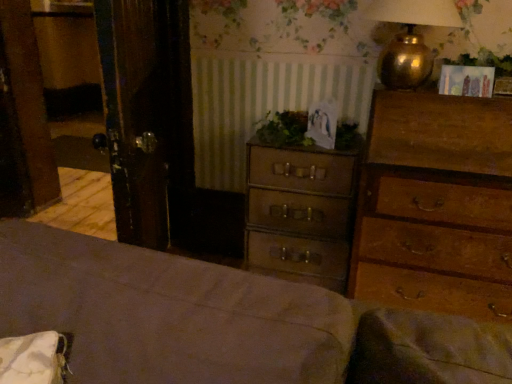
Measure the distance between wooden chest of drawers at right, which is counted as the 1th chest of drawers, starting from the right, and camera.

wooden chest of drawers at right, which is counted as the 1th chest of drawers, starting from the right, is 4.45 feet away from camera.

Where is `gold metallic lamp at upper right`? gold metallic lamp at upper right is located at coordinates (409, 39).

Where is `brown wooden bed frame at lower left`? Image resolution: width=512 pixels, height=384 pixels. brown wooden bed frame at lower left is located at coordinates (222, 321).

Find the location of a particular element. The height and width of the screenshot is (384, 512). green leafy plant at center, which is the 1th plant from left to right is located at coordinates (284, 129).

Locate an element on the screen. The width and height of the screenshot is (512, 384). brown leather suitcase at center, which ranks as the first chest of drawers in left-to-right order is located at coordinates (300, 212).

I want to click on green leafy plant at upper right, acting as the 2th plant starting from the bottom, so click(x=485, y=61).

From the image's perspective, starting from the brown leather suitcase at center, which ranks as the first chest of drawers in left-to-right order, which plant is the 2nd one above? Please provide its 2D coordinates.

[(485, 61)]

Between green leafy plant at upper right, acting as the 2th plant starting from the bottom, and brown leather suitcase at center, which ranks as the first chest of drawers in left-to-right order, which one is positioned behind?

brown leather suitcase at center, which ranks as the first chest of drawers in left-to-right order, is behind.

Is green leafy plant at upper right, the first plant from the right, taller than brown leather suitcase at center, which ranks as the first chest of drawers in left-to-right order?

In fact, green leafy plant at upper right, the first plant from the right, may be shorter than brown leather suitcase at center, which ranks as the first chest of drawers in left-to-right order.

Which of these two, brown wooden bed frame at lower left or gold metallic lamp at upper right, stands shorter?

With less height is gold metallic lamp at upper right.

Is point (176, 362) closer to viewer compared to point (424, 66)?

Yes, it is.

Is brown wooden bed frame at lower left thinner than gold metallic lamp at upper right?

No.

Measure the distance from brown wooden bed frame at lower left to wooden picture frame at upper right.

They are 4.10 feet apart.

The image size is (512, 384). What are the coordinates of `bed frame located in front of the wooden picture frame at upper right` in the screenshot? It's located at (222, 321).

Which is behind, brown wooden bed frame at lower left or wooden picture frame at upper right?

Positioned behind is wooden picture frame at upper right.

From the image's perspective, does brown wooden bed frame at lower left appear lower than wooden picture frame at upper right?

Yes, from the image's perspective, brown wooden bed frame at lower left is below wooden picture frame at upper right.

Is gold metallic lamp at upper right closer to the viewer compared to wooden picture frame at upper right?

That is True.

From the image's perspective, which object appears higher, gold metallic lamp at upper right or wooden picture frame at upper right?

gold metallic lamp at upper right.

Visually, is gold metallic lamp at upper right positioned to the left or to the right of wooden picture frame at upper right?

In the image, gold metallic lamp at upper right appears on the left side of wooden picture frame at upper right.

How many degrees apart are the facing directions of gold metallic lamp at upper right and wooden picture frame at upper right?

There is a 3.41-degree angle between the facing directions of gold metallic lamp at upper right and wooden picture frame at upper right.

Considering the relative sizes of brown wooden bed frame at lower left and wooden chest of drawers at right, which is counted as the 1th chest of drawers, starting from the right, in the image provided, is brown wooden bed frame at lower left shorter than wooden chest of drawers at right, which is counted as the 1th chest of drawers, starting from the right,?

Indeed, brown wooden bed frame at lower left has a lesser height compared to wooden chest of drawers at right, which is counted as the 1th chest of drawers, starting from the right.

Is brown wooden bed frame at lower left next to wooden chest of drawers at right, which is the 2th chest of drawers from left to right, and touching it?

brown wooden bed frame at lower left and wooden chest of drawers at right, which is the 2th chest of drawers from left to right, are not in contact.

Does point (90, 269) appear closer or farther from the camera than point (476, 227)?

Point (90, 269) is positioned closer to the camera compared to point (476, 227).

From the picture: Considering the positions of objects brown wooden bed frame at lower left and wooden chest of drawers at right, which is counted as the 1th chest of drawers, starting from the right, in the image provided, who is more to the right, brown wooden bed frame at lower left or wooden chest of drawers at right, which is counted as the 1th chest of drawers, starting from the right,?

wooden chest of drawers at right, which is counted as the 1th chest of drawers, starting from the right, is more to the right.

Identify the location of the chest of drawers that is the 2nd one below the wooden picture frame at upper right (from a real-world perspective). The height and width of the screenshot is (384, 512). (436, 206).

Relative to wooden chest of drawers at right, which is the 2th chest of drawers from left to right, is wooden picture frame at upper right in front or behind?

Clearly, wooden picture frame at upper right is behind wooden chest of drawers at right, which is the 2th chest of drawers from left to right.

Who is shorter, wooden picture frame at upper right or wooden chest of drawers at right, which is the 2th chest of drawers from left to right?

wooden picture frame at upper right is shorter.

What's the angular difference between wooden picture frame at upper right and wooden chest of drawers at right, which is counted as the 1th chest of drawers, starting from the right,'s facing directions?

1.42 degrees.

Can you confirm if wooden chest of drawers at right, which is the 2th chest of drawers from left to right, is shorter than green leafy plant at upper right, positioned as the first plant in top-to-bottom order?

Incorrect, the height of wooden chest of drawers at right, which is the 2th chest of drawers from left to right, does not fall short of that of green leafy plant at upper right, positioned as the first plant in top-to-bottom order.

Choose the correct answer: Is wooden chest of drawers at right, which is counted as the 1th chest of drawers, starting from the right, inside green leafy plant at upper right, the first plant from the right, or outside it?

wooden chest of drawers at right, which is counted as the 1th chest of drawers, starting from the right, is not inside green leafy plant at upper right, the first plant from the right, it's outside.

Is green leafy plant at upper right, marked as the 2th plant in a left-to-right arrangement, at the back of wooden chest of drawers at right, which is counted as the 1th chest of drawers, starting from the right?

No, wooden chest of drawers at right, which is counted as the 1th chest of drawers, starting from the right,'s orientation is not away from green leafy plant at upper right, marked as the 2th plant in a left-to-right arrangement.

Based on the photo, which is in front, wooden chest of drawers at right, which is counted as the 1th chest of drawers, starting from the right, or green leafy plant at upper right, the first plant from the right?

wooden chest of drawers at right, which is counted as the 1th chest of drawers, starting from the right, is more forward.

From a real-world perspective, count 1st chest of drawerss downward from the green leafy plant at upper right, marked as the 2th plant in a left-to-right arrangement, and point to it. Please provide its 2D coordinates.

[(300, 212)]

The height and width of the screenshot is (384, 512). I want to click on table lamp behind the brown wooden bed frame at lower left, so click(x=409, y=39).

Which object lies further to the anchor point brown wooden bed frame at lower left, gold metallic lamp at upper right or wooden chest of drawers at right, which is the 2th chest of drawers from left to right?

The object further to brown wooden bed frame at lower left is gold metallic lamp at upper right.

Which object lies further to the anchor point wooden picture frame at upper right, green leafy plant at center, which is the 1th plant from left to right, or green leafy plant at upper right, the first plant from the right?

Based on the image, green leafy plant at center, which is the 1th plant from left to right, appears to be further to wooden picture frame at upper right.

Looking at the image, which one is located closer to wooden picture frame at upper right, green leafy plant at center, positioned as the second plant in top-to-bottom order, or brown wooden bed frame at lower left?

The object closer to wooden picture frame at upper right is green leafy plant at center, positioned as the second plant in top-to-bottom order.

When comparing their distances from green leafy plant at upper right, the first plant from the right, does wooden chest of drawers at right, which is the 2th chest of drawers from left to right, or brown wooden bed frame at lower left seem further?

brown wooden bed frame at lower left.

Which object lies nearer to the anchor point brown leather suitcase at center, which ranks as the first chest of drawers in left-to-right order, wooden chest of drawers at right, which is the 2th chest of drawers from left to right, or brown wooden bed frame at lower left?

Based on the image, wooden chest of drawers at right, which is the 2th chest of drawers from left to right, appears to be nearer to brown leather suitcase at center, which ranks as the first chest of drawers in left-to-right order.

Which object lies further to the anchor point gold metallic lamp at upper right, brown leather suitcase at center, which ranks as the first chest of drawers in left-to-right order, or green leafy plant at upper right, marked as the 2th plant in a left-to-right arrangement?

brown leather suitcase at center, which ranks as the first chest of drawers in left-to-right order, is positioned further to the anchor gold metallic lamp at upper right.

Considering their positions, is green leafy plant at center, arranged as the 2th plant when viewed from the right, positioned further to green leafy plant at upper right, positioned as the first plant in top-to-bottom order, than brown wooden bed frame at lower left?

brown wooden bed frame at lower left lies further to green leafy plant at upper right, positioned as the first plant in top-to-bottom order, than the other object.

From the image, which object appears to be nearer to brown leather suitcase at center, which ranks as the first chest of drawers in left-to-right order, green leafy plant at upper right, marked as the 2th plant in a left-to-right arrangement, or gold metallic lamp at upper right?

gold metallic lamp at upper right lies closer to brown leather suitcase at center, which ranks as the first chest of drawers in left-to-right order, than the other object.

You are a GUI agent. You are given a task and a screenshot of the screen. Output one action in this format:
    pyautogui.click(x=<x>, y=<y>)
    Task: Click on the table lamp between brown leather suitcase at center, which ranks as the first chest of drawers in left-to-right order, and wooden picture frame at upper right
    
    Given the screenshot: What is the action you would take?
    pyautogui.click(x=409, y=39)

I want to click on picture frame between gold metallic lamp at upper right and wooden chest of drawers at right, which is the 2th chest of drawers from left to right, vertically, so click(x=466, y=81).

This screenshot has height=384, width=512. What are the coordinates of `picture frame between green leafy plant at upper right, marked as the 2th plant in a left-to-right arrangement, and wooden chest of drawers at right, which is the 2th chest of drawers from left to right, vertically` in the screenshot? It's located at (466, 81).

Where is `the chest of drawers located between green leafy plant at center, which is the 1th plant from left to right, and gold metallic lamp at upper right in the left-right direction`? The image size is (512, 384). the chest of drawers located between green leafy plant at center, which is the 1th plant from left to right, and gold metallic lamp at upper right in the left-right direction is located at coordinates (300, 212).